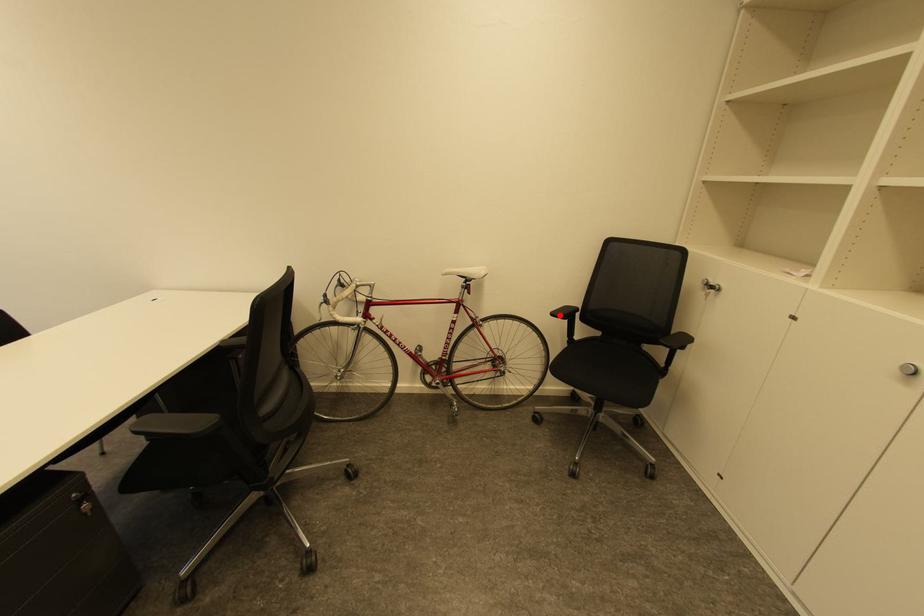
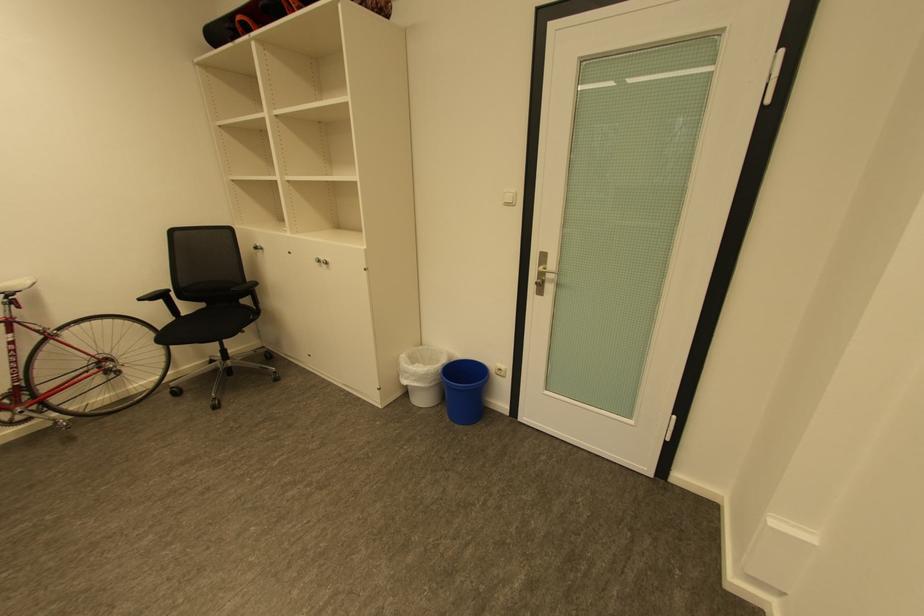
In the second image, find the point that corresponds to the highlighted location in the first image.

(148, 300)